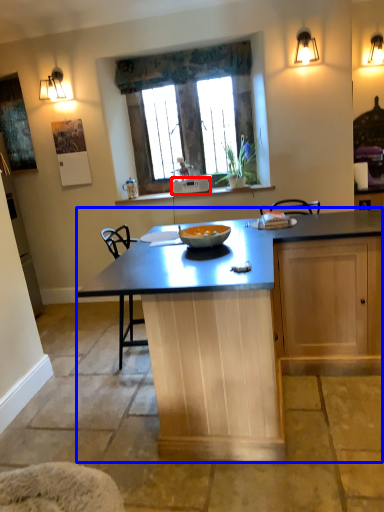
Question: Which object appears closest to the camera in this image, appliance (highlighted by a red box) or kitchen & dining room table (highlighted by a blue box)?

Choices:
 (A) appliance
 (B) kitchen & dining room table

Answer: (B)